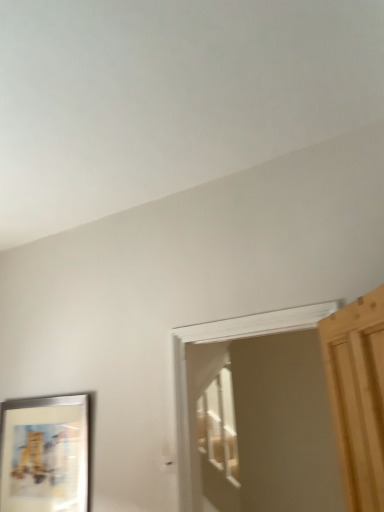
Question: From a real-world perspective, relative to wooden screen door at center, is metallic silver picture frame at lower left vertically above or below?

Choices:
 (A) below
 (B) above

Answer: (A)

Question: From their relative heights in the image, would you say metallic silver picture frame at lower left is taller or shorter than wooden screen door at center?

Choices:
 (A) tall
 (B) short

Answer: (B)

Question: Is metallic silver picture frame at lower left inside or outside of wooden screen door at center?

Choices:
 (A) outside
 (B) inside

Answer: (A)

Question: From their relative heights in the image, would you say wooden screen door at center is taller or shorter than metallic silver picture frame at lower left?

Choices:
 (A) short
 (B) tall

Answer: (B)

Question: Choose the correct answer: Is wooden screen door at center inside metallic silver picture frame at lower left or outside it?

Choices:
 (A) inside
 (B) outside

Answer: (B)

Question: Considering the relative positions of wooden screen door at center and metallic silver picture frame at lower left in the image provided, is wooden screen door at center to the left or to the right of metallic silver picture frame at lower left?

Choices:
 (A) right
 (B) left

Answer: (A)

Question: From a real-world perspective, is wooden screen door at center positioned above or below metallic silver picture frame at lower left?

Choices:
 (A) above
 (B) below

Answer: (A)